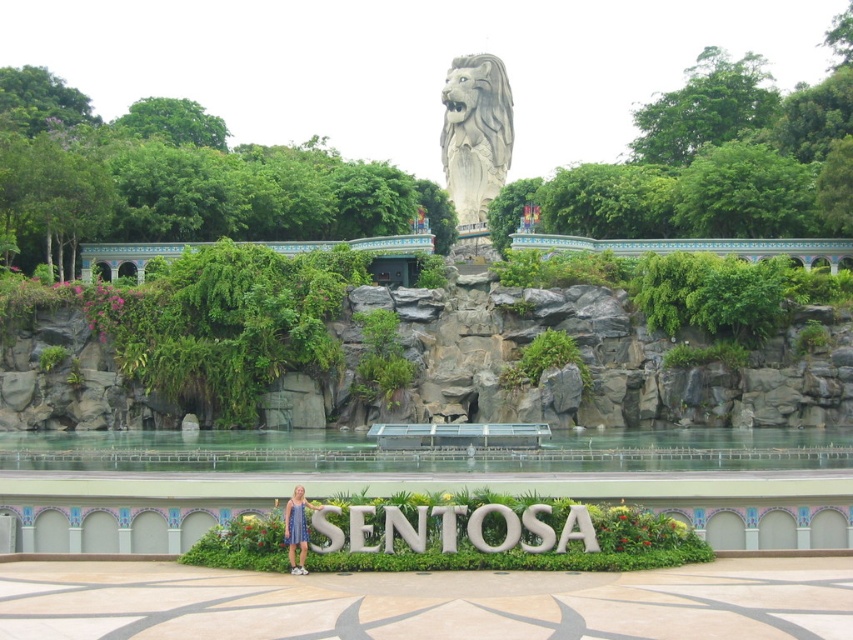
You are a photographer trying to capture the gray stone lion at upper center and the blue fabric dress at lower center in the same frame. Can you position yourself so that both are visible without moving either object?

The gray stone lion at upper center is above the blue fabric dress at lower center, so yes, you can position yourself to see both in the same frame as long as your camera angle includes the vertical space between them.

You are a photographer planning to capture a wide shot of the SENTOSA sign. You need to ensure both the gray stone lion at upper center and the blue fabric dress at lower center are in frame. Which object will appear wider in the photo?

The gray stone lion at upper center will appear wider in the photo because its width surpasses that of the blue fabric dress at lower center.